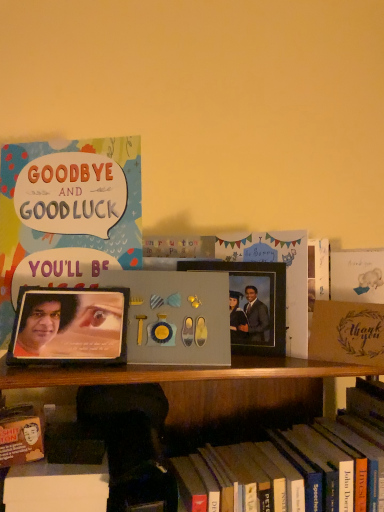
Question: Is metallic photo frame at center, the second picture frame from the front, further to camera compared to hardcover book at lower center, which is the 1th book in right-to-left order?

Choices:
 (A) yes
 (B) no

Answer: (A)

Question: From the image's perspective, is metallic photo frame at center, which is the second picture frame from left to right, located beneath hardcover book at lower center, which is the 1th book in right-to-left order?

Choices:
 (A) yes
 (B) no

Answer: (B)

Question: Is metallic photo frame at center, the second picture frame from the front, shorter than hardcover book at lower center, positioned as the 1th book in bottom-to-top order?

Choices:
 (A) yes
 (B) no

Answer: (A)

Question: From a real-world perspective, is metallic photo frame at center, which is the 1th picture frame in right-to-left order, physically above hardcover book at lower center, which is the 2th book in top-to-bottom order?

Choices:
 (A) yes
 (B) no

Answer: (A)

Question: Is metallic photo frame at center, which is the 1th picture frame in right-to-left order, thinner than hardcover book at lower center, which is the 2th book in top-to-bottom order?

Choices:
 (A) yes
 (B) no

Answer: (A)

Question: Is metallic photo frame at center, the second picture frame from the front, not near hardcover book at lower center, positioned as the 1th book in bottom-to-top order?

Choices:
 (A) no
 (B) yes

Answer: (A)

Question: Is metallic photo frame at center, acting as the first picture frame starting from the back, at the back of matte cardstock card at upper left, arranged as the second book when ordered from the bottom?

Choices:
 (A) no
 (B) yes

Answer: (A)

Question: Is matte cardstock card at upper left, arranged as the second book when ordered from the bottom, bigger than metallic photo frame at center, acting as the first picture frame starting from the back?

Choices:
 (A) no
 (B) yes

Answer: (B)

Question: From a real-world perspective, is matte cardstock card at upper left, arranged as the second book when ordered from the bottom, over metallic photo frame at center, which is the second picture frame from left to right?

Choices:
 (A) no
 (B) yes

Answer: (B)

Question: Is matte cardstock card at upper left, arranged as the second book when ordered from the bottom, closer to the viewer compared to metallic photo frame at center, which is the 1th picture frame in right-to-left order?

Choices:
 (A) no
 (B) yes

Answer: (B)

Question: Considering the relative positions of matte cardstock card at upper left, which is the first book from top to bottom, and metallic photo frame at center, which is the 1th picture frame in right-to-left order, in the image provided, is matte cardstock card at upper left, which is the first book from top to bottom, to the left of metallic photo frame at center, which is the 1th picture frame in right-to-left order, from the viewer's perspective?

Choices:
 (A) yes
 (B) no

Answer: (A)

Question: Is metallic photo frame at center, which is the 1th picture frame in right-to-left order, a part of matte cardstock card at upper left, which is the first book from top to bottom?

Choices:
 (A) yes
 (B) no

Answer: (B)

Question: From the image's perspective, is brown textured paper at right on top of matte cardstock card at upper left, which is the 1th book in left-to-right order?

Choices:
 (A) yes
 (B) no

Answer: (B)